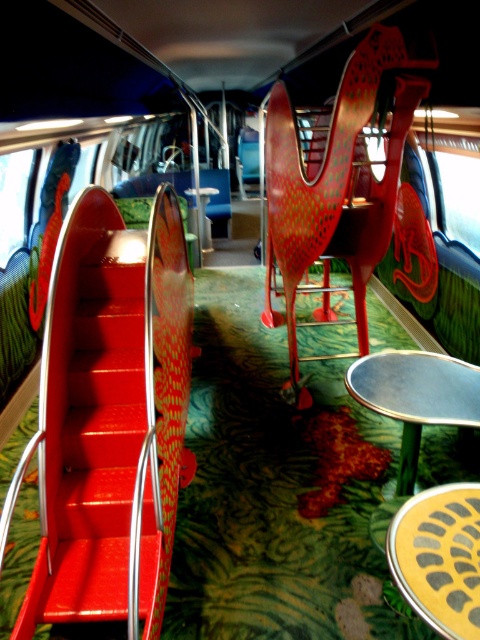
You are a parent trying to decide where to place a small backpack in the bus interior. The shiny red slide at left and the metallic red chair at center are both potential spots. Based on their sizes, which object would allow the backpack to fit better?

The metallic red chair at center occupies more space than the shiny red slide at left, so placing the backpack near the metallic red chair at center would provide more space for the backpack to fit better.